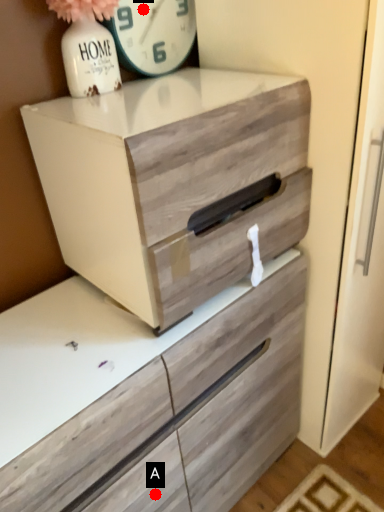
Question: Two points are circled on the image, labeled by A and B beside each circle. Which point is farther from the camera taking this photo?

Choices:
 (A) A is further
 (B) B is further

Answer: (B)